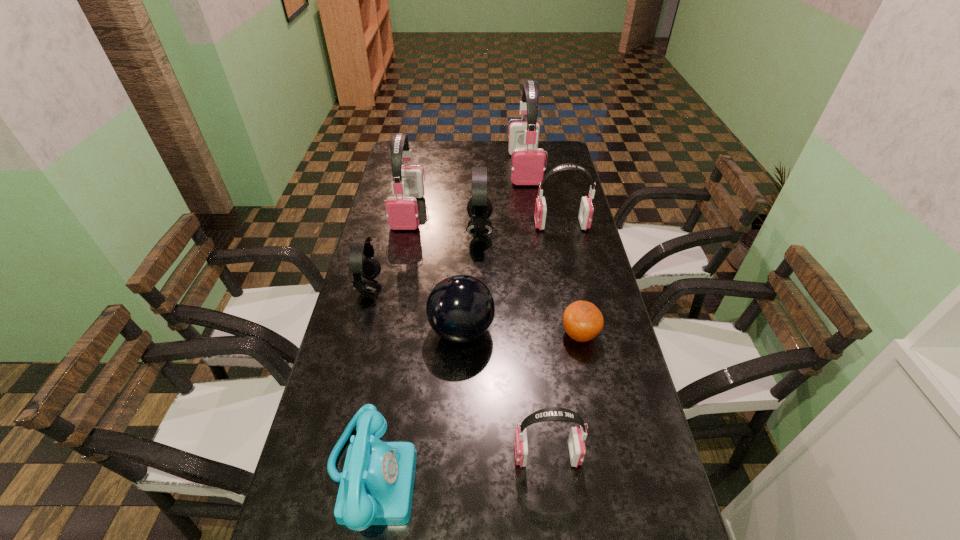
The width and height of the screenshot is (960, 540). Find the location of `vacant point located on the side of the bowling ball with the finger holes`. vacant point located on the side of the bowling ball with the finger holes is located at coordinates (543, 330).

The width and height of the screenshot is (960, 540). I want to click on blank space located on the ear cups of the nearer black earphone, so click(x=467, y=287).

At what (x,y) coordinates should I click in order to perform the action: click on free point located on the outer surface of the nearest earphone. Please return your answer as a coordinate pair (x, y). Looking at the image, I should click on (470, 455).

Where is `vacant space located on the outer surface of the nearest earphone`? The image size is (960, 540). vacant space located on the outer surface of the nearest earphone is located at coordinates (457, 455).

Find the location of a particular element. This screenshot has width=960, height=540. free space located on the outer surface of the nearest earphone is located at coordinates (395, 455).

Locate an element on the screen. The height and width of the screenshot is (540, 960). vacant space located 0.210m on the back of the shortest object is located at coordinates (566, 271).

What are the coordinates of `object at the far edge` in the screenshot? It's located at (527, 160).

Where is `orange that is at the right edge`? orange that is at the right edge is located at coordinates (582, 320).

Find the location of a particular element. object situated at the far right corner is located at coordinates (527, 160).

Identify the location of free space at the far edge of the desktop. Image resolution: width=960 pixels, height=540 pixels. (438, 141).